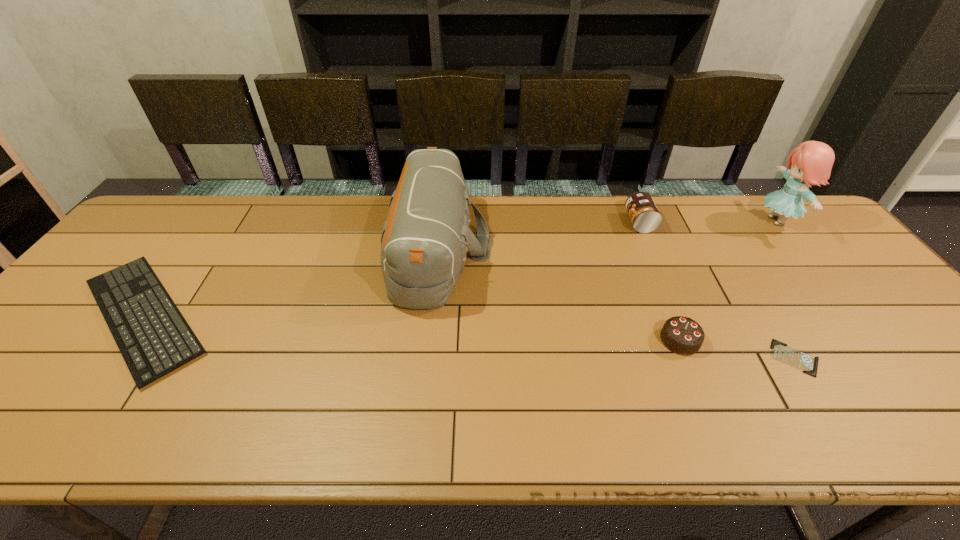
Identify the location of doll. (811, 162).

Find the location of a particular element. The image size is (960, 540). the tallest object is located at coordinates (811, 162).

Image resolution: width=960 pixels, height=540 pixels. I want to click on the second object from left to right, so click(424, 239).

Locate an element on the screen. The image size is (960, 540). the fifth shortest object is located at coordinates (424, 239).

Where is `the fourth shortest object`? the fourth shortest object is located at coordinates (645, 217).

Where is `the third shortest object`? The width and height of the screenshot is (960, 540). the third shortest object is located at coordinates pos(681,335).

The height and width of the screenshot is (540, 960). In order to click on the shortest object in this screenshot , I will do `click(807, 363)`.

Identify the location of identity card. This screenshot has width=960, height=540. (807, 363).

The height and width of the screenshot is (540, 960). I want to click on blank area located on the front-facing side of the tallest object, so click(674, 221).

Find the location of a particular element. Image resolution: width=960 pixels, height=540 pixels. vacant space located on the front-facing side of the tallest object is located at coordinates (665, 221).